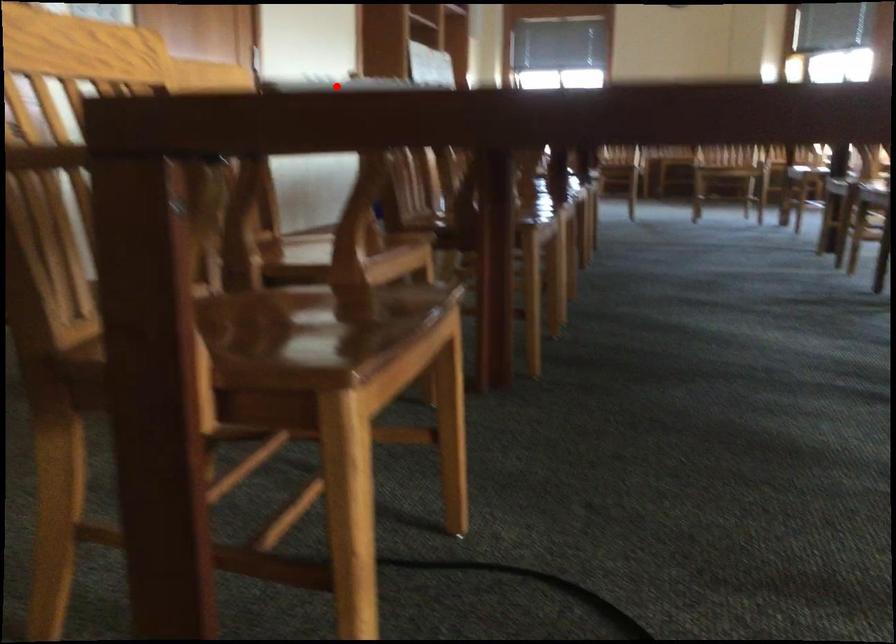
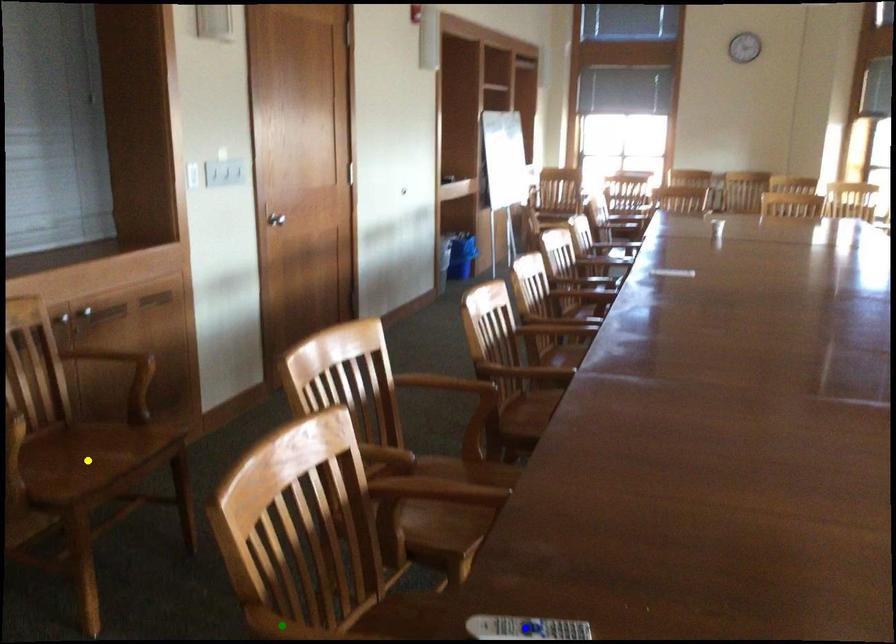
Question: I am providing you with two images of the same scene from different viewpoints. A red point is marked on the first image. You are given multiple points on the second image. Which point in image 2 is actually the same real-world point as the red point in image 1?

Choices:
 (A) green point
 (B) yellow point
 (C) blue point

Answer: (C)